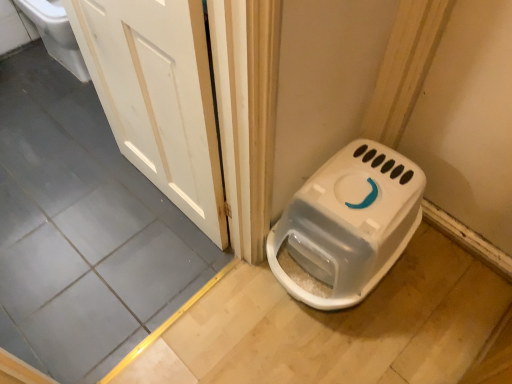
Image resolution: width=512 pixels, height=384 pixels. Find the location of `vacant space in front of white plastic litter box at lower right`. vacant space in front of white plastic litter box at lower right is located at coordinates (345, 344).